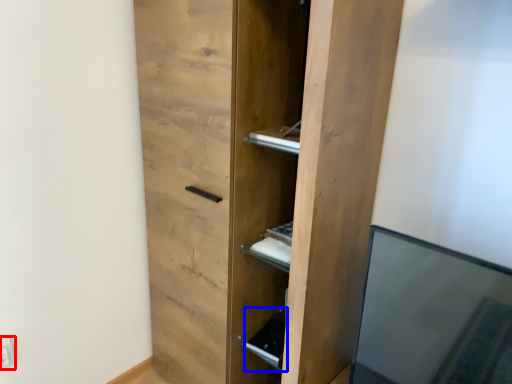
Question: Which object appears closest to the camera in this image, electric outlet (highlighted by a red box) or cabinet (highlighted by a blue box)?

Choices:
 (A) electric outlet
 (B) cabinet

Answer: (A)